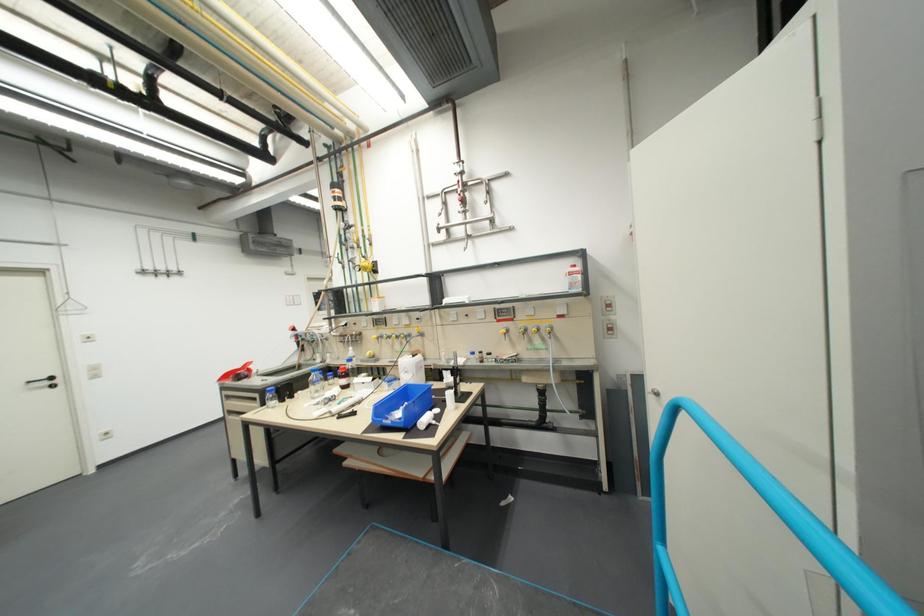
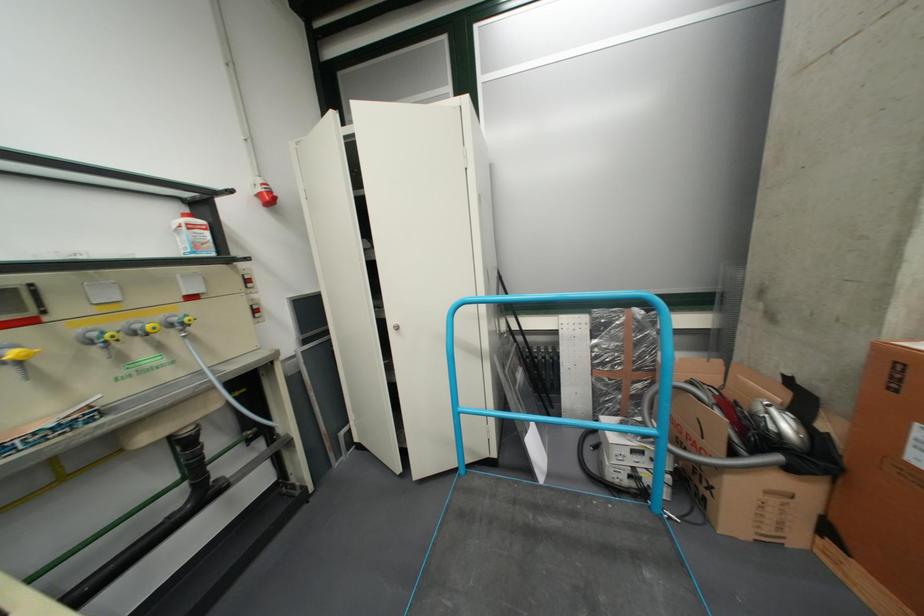
Where in the second image is the point corresponding to pixel 584 286 from the first image?

(208, 246)